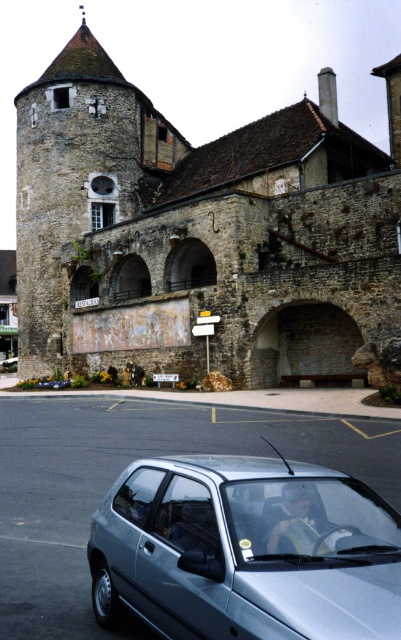
You are a delivery driver who needs to park your vehicle in front of the historic stone building. The vehicle has a white plastic license plate at center. There is a stone tower at center in the parking area. Can you park your vehicle so that the license plate is visible from the front?

The stone tower at center is positioned over the white plastic license plate at center, so parking the vehicle would result in the license plate being obscured by the tower. Therefore, you cannot park there if you need the license plate to remain visible.

You are a delivery person who needs to park your vehicle in a space that can only accommodate vehicles shorter than the white plastic license plate at center. Can the satin silver car at lower center fit in that parking spot?

The satin silver car at lower center is taller than the white plastic license plate at center, so it cannot fit in the parking spot designed for vehicles shorter than the license plate.